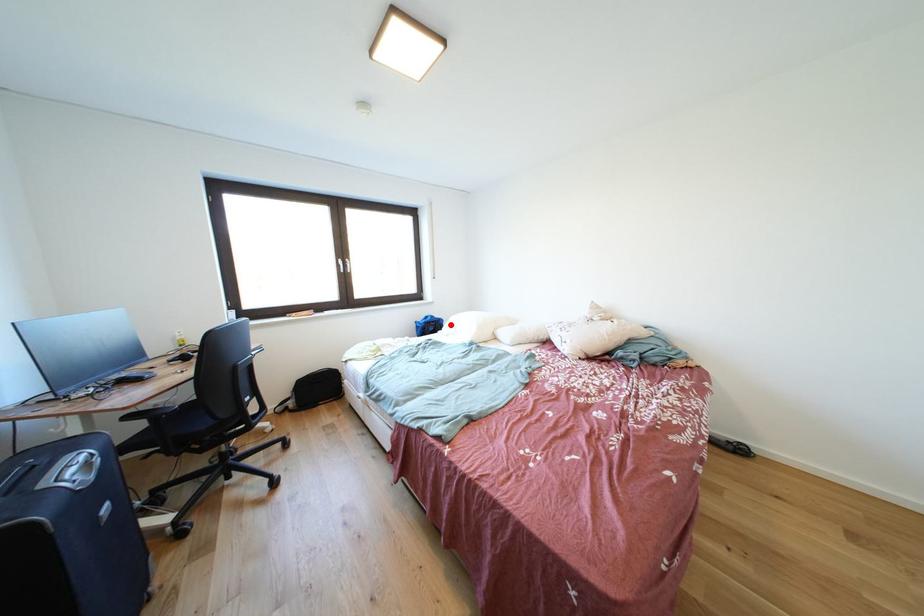
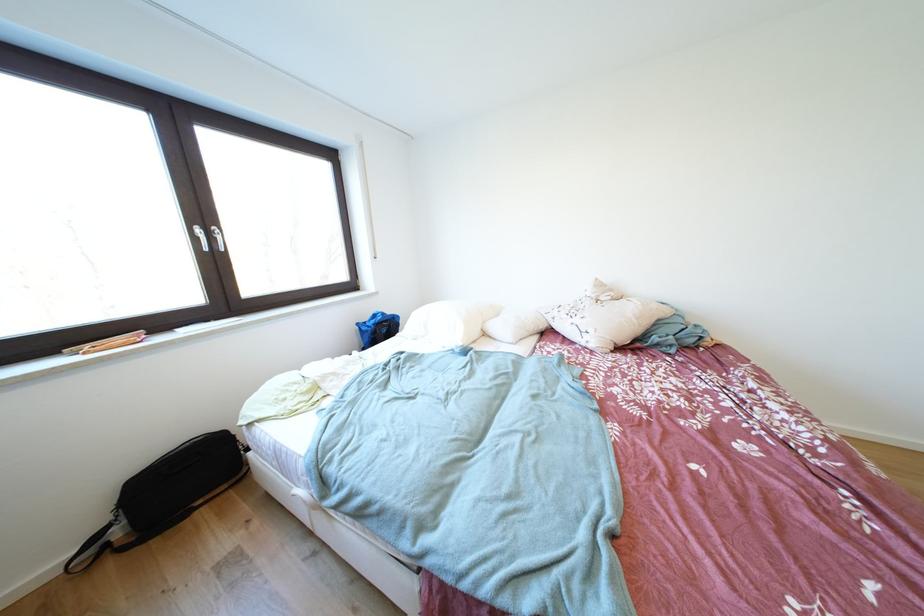
The point at the highlighted location is marked in the first image. Where is the corresponding point in the second image?

(407, 321)